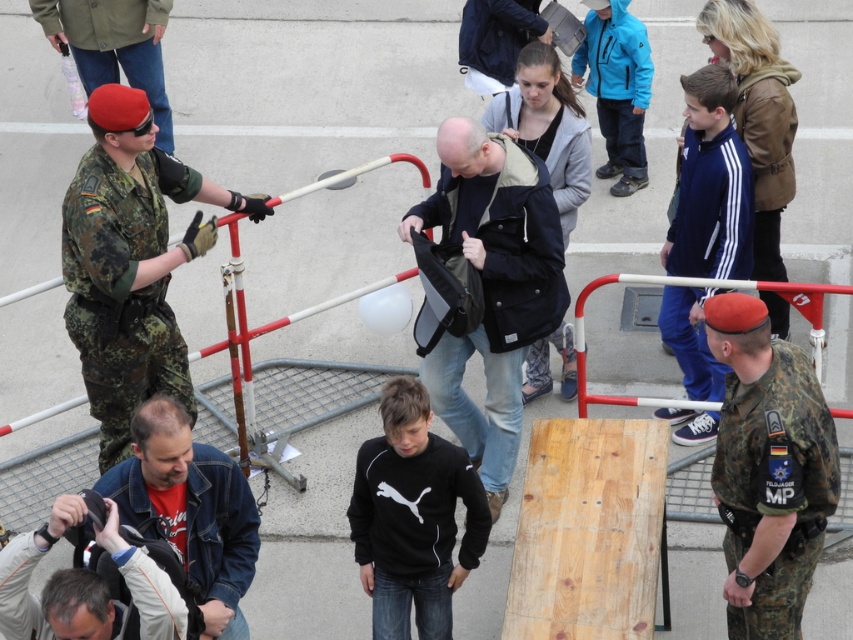
You are a photographer positioned at the edge of the scene. You need to capture a photo that includes both the blue synthetic jacket at upper right and the navy blue fabric jacket at center. Given their positions, can you frame them in a single shot without moving your camera?

The blue synthetic jacket at upper right is 26.19 inches away from the navy blue fabric jacket at center. Since they are relatively close, it is possible to frame both in a single shot without moving the camera.

You are a photographer at the event and want to capture a clear photo of both the dark blue leather jacket at center and the navy blue fabric jacket at center. Since you can only focus on one jacket at a time, which jacket should you focus on to ensure the other appears blurry in the background?

You should focus on the dark blue leather jacket at center because it is closer to the viewer than the navy blue fabric jacket at center. By focusing on the closer jacket, the farther one will naturally appear blurry in the background.